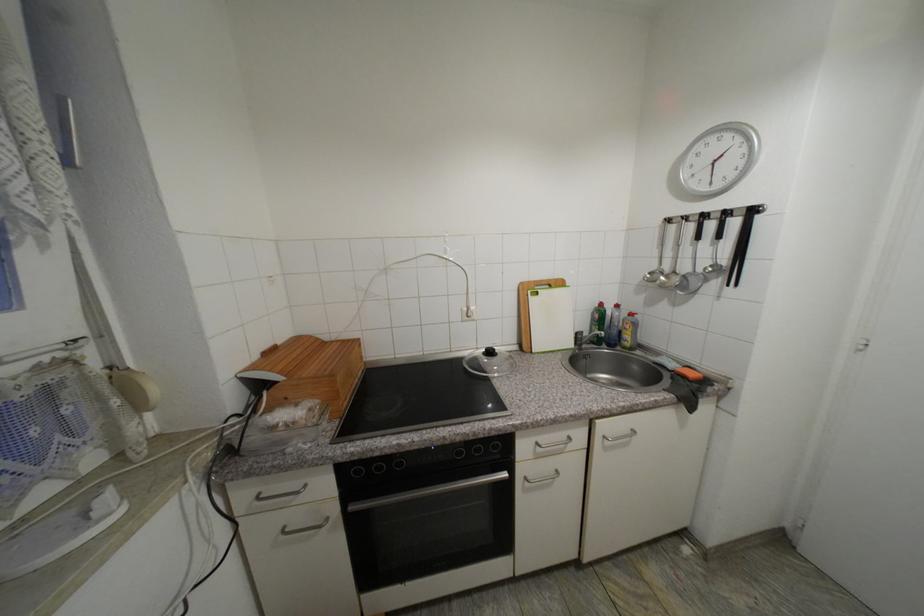
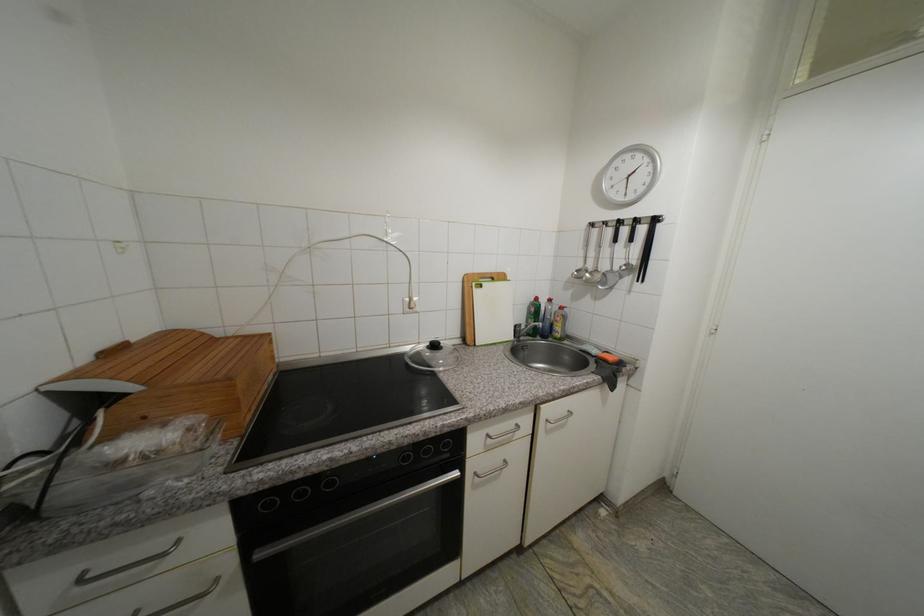
In a continuous first-person perspective shot, in which direction is the camera moving?

The cameraman walked toward left, forward.